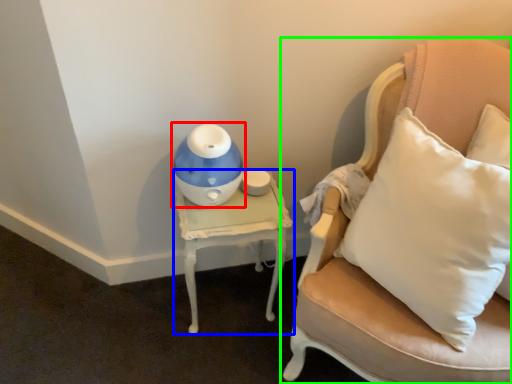
Question: Which object is the closest to the toy (highlighted by a red box)? Choose among these: table (highlighted by a blue box) or chair (highlighted by a green box).

Choices:
 (A) table
 (B) chair

Answer: (A)